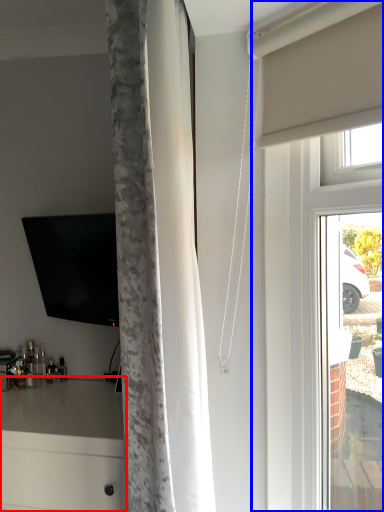
Question: Which point is further to the camera, counter (highlighted by a red box) or glass door (highlighted by a blue box)?

Choices:
 (A) counter
 (B) glass door

Answer: (A)